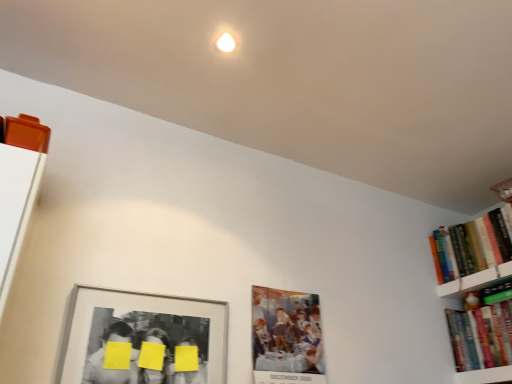
Question: Is matte paper picture frame at center, which is counted as the first picture frame, starting from the right, wider than hardcover books at right, positioned as the second book in bottom-to-top order?

Choices:
 (A) no
 (B) yes

Answer: (A)

Question: From a real-world perspective, is matte paper picture frame at center, which is counted as the second picture frame, starting from the left, over hardcover books at right, which is counted as the 1th book, starting from the top?

Choices:
 (A) no
 (B) yes

Answer: (A)

Question: Could you tell me if matte paper picture frame at center, which is counted as the second picture frame, starting from the left, is turned towards hardcover books at right, positioned as the second book in bottom-to-top order?

Choices:
 (A) yes
 (B) no

Answer: (B)

Question: Is matte paper picture frame at center, which is counted as the first picture frame, starting from the right, smaller than hardcover books at right, which is counted as the 1th book, starting from the top?

Choices:
 (A) yes
 (B) no

Answer: (A)

Question: Considering the relative positions of matte paper picture frame at center, which is counted as the first picture frame, starting from the right, and hardcover books at right, which is counted as the 1th book, starting from the top, in the image provided, is matte paper picture frame at center, which is counted as the first picture frame, starting from the right, to the left of hardcover books at right, which is counted as the 1th book, starting from the top, from the viewer's perspective?

Choices:
 (A) yes
 (B) no

Answer: (A)

Question: Can you confirm if matte paper picture frame at center, which is counted as the first picture frame, starting from the right, is shorter than hardcover books at right, positioned as the second book in bottom-to-top order?

Choices:
 (A) no
 (B) yes

Answer: (A)

Question: Is hardcover books at right, positioned as the second book in bottom-to-top order, at the left side of yellow matte paper at center?

Choices:
 (A) no
 (B) yes

Answer: (A)

Question: Can you confirm if hardcover books at right, which is counted as the 1th book, starting from the top, is smaller than yellow matte paper at center?

Choices:
 (A) no
 (B) yes

Answer: (A)

Question: Is hardcover books at right, positioned as the second book in bottom-to-top order, facing towards yellow matte paper at center?

Choices:
 (A) yes
 (B) no

Answer: (B)

Question: From the image's perspective, would you say hardcover books at right, which is counted as the 1th book, starting from the top, is positioned over yellow matte paper at center?

Choices:
 (A) yes
 (B) no

Answer: (A)

Question: From the image's perspective, is hardcover books at right, positioned as the second book in bottom-to-top order, under yellow matte paper at center?

Choices:
 (A) yes
 (B) no

Answer: (B)

Question: Does hardcover books at right, which is counted as the 1th book, starting from the top, have a greater width compared to yellow matte paper at center?

Choices:
 (A) no
 (B) yes

Answer: (B)

Question: Considering the relative sizes of hardcover books at right, which is counted as the 1th book, starting from the top, and matte paper picture frame at center, which is counted as the second picture frame, starting from the left, in the image provided, is hardcover books at right, which is counted as the 1th book, starting from the top, smaller than matte paper picture frame at center, which is counted as the second picture frame, starting from the left,?

Choices:
 (A) yes
 (B) no

Answer: (B)